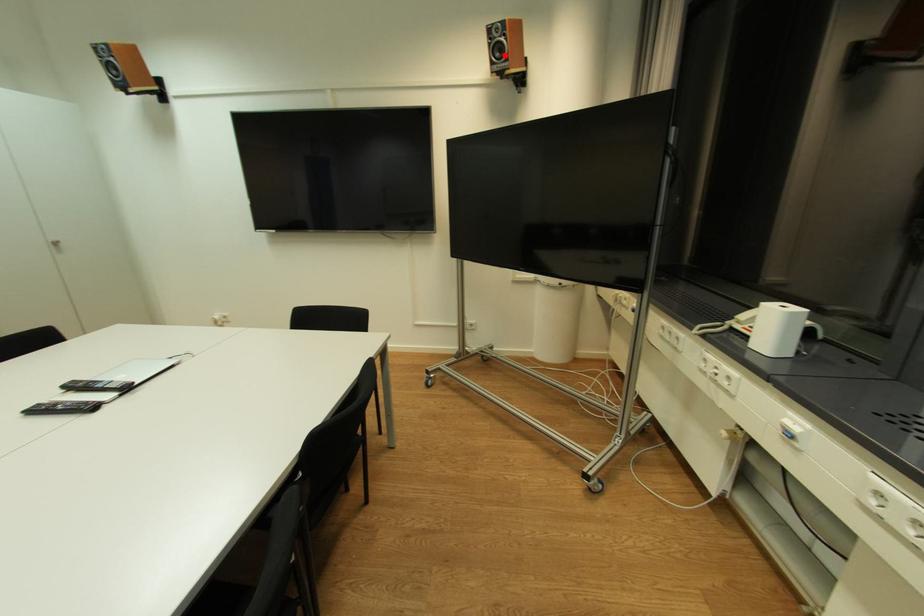
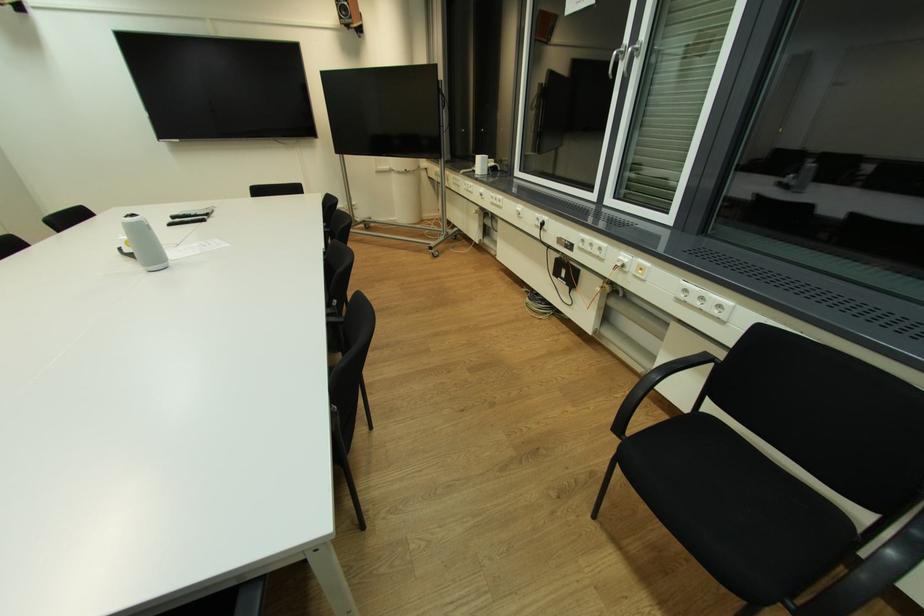
The point at the highlighted location is marked in the first image. Where is the corresponding point in the second image?

(349, 15)